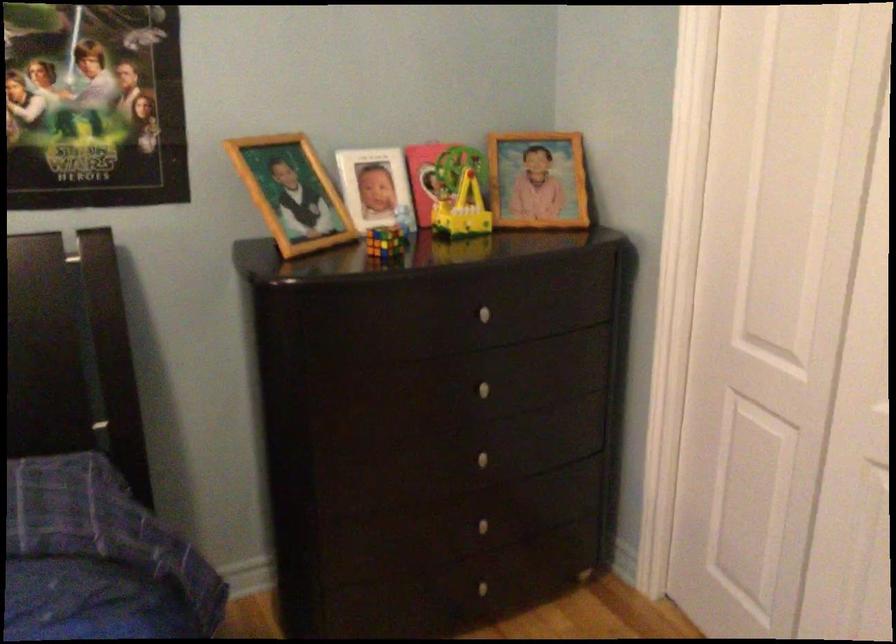
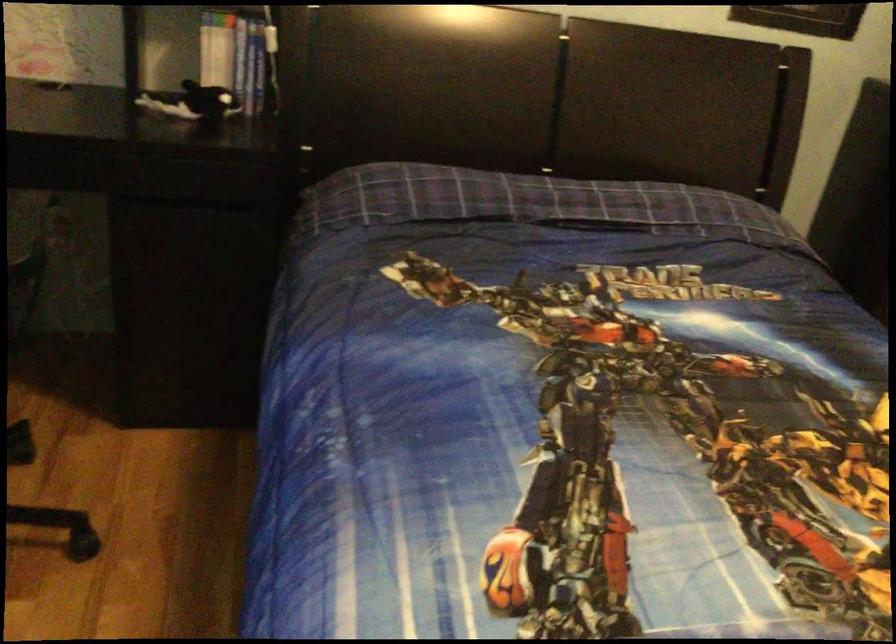
In a continuous first-person perspective shot, in which direction is the camera moving?

The movement direction of the cameraman is left, backward.